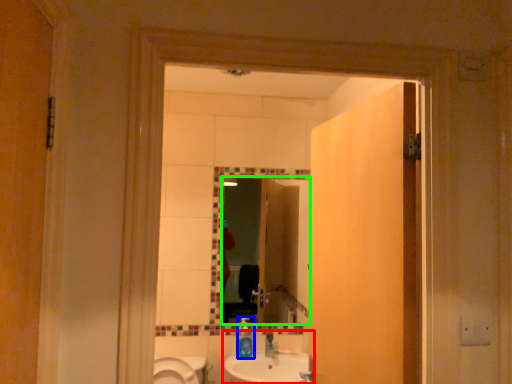
Question: Which object is the closest to the sink (highlighted by a red box)? Choose among these: bottle (highlighted by a blue box) or mirror (highlighted by a green box).

Choices:
 (A) bottle
 (B) mirror

Answer: (A)